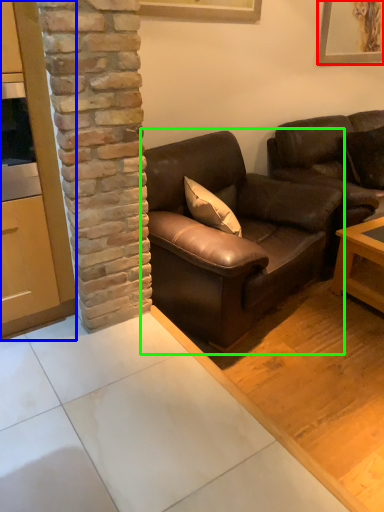
Question: Which object is the farthest from picture frame (highlighted by a red box)? Choose among these: cabinetry (highlighted by a blue box) or studio couch (highlighted by a green box).

Choices:
 (A) cabinetry
 (B) studio couch

Answer: (A)